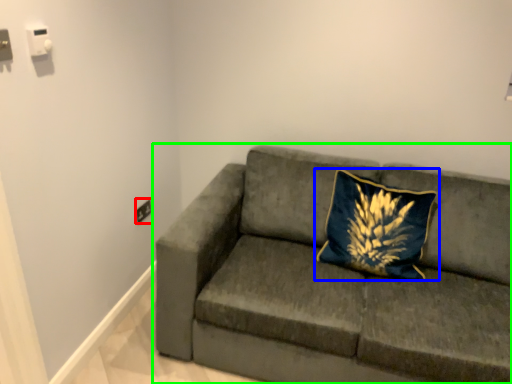
Question: Considering the real-world distances, which object is closest to electric outlet (highlighted by a red box)? pillow (highlighted by a blue box) or studio couch (highlighted by a green box).

Choices:
 (A) pillow
 (B) studio couch

Answer: (B)